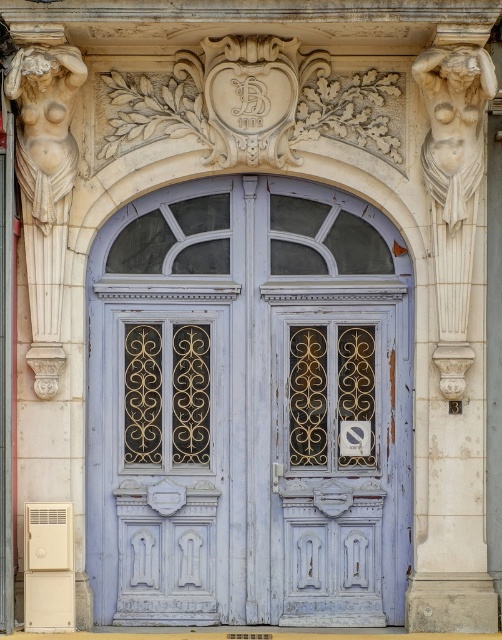
Does chipped paint wooden door at center have a greater height compared to white stone nude figure at right?

Indeed, chipped paint wooden door at center has a greater height compared to white stone nude figure at right.

Can you confirm if chipped paint wooden door at center is positioned to the left of white stone nude figure at right?

Indeed, chipped paint wooden door at center is positioned on the left side of white stone nude figure at right.

Consider the image. Who is more distant from viewer, (386, 472) or (462, 77)?

The point (386, 472) is more distant.

Locate an element on the screen. This screenshot has height=640, width=502. chipped paint wooden door at center is located at coordinates (339, 451).

Which of these two, light blue wood door at center or chipped paint wooden door at center, stands shorter?

With less height is chipped paint wooden door at center.

Looking at this image, does light blue wood door at center appear on the left side of chipped paint wooden door at center?

Indeed, light blue wood door at center is positioned on the left side of chipped paint wooden door at center.

Is point (146, 378) closer to camera compared to point (403, 349)?

No.

Locate an element on the screen. light blue wood door at center is located at coordinates (248, 408).

Who is positioned more to the right, light blue wood door at center or white stone nude figure at right?

Positioned to the right is white stone nude figure at right.

Between point (139, 312) and point (443, 113), which one is positioned behind?

Positioned behind is point (139, 312).

You are a GUI agent. You are given a task and a screenshot of the screen. Output one action in this format:
    pyautogui.click(x=<x>, y=<y>)
    Task: Click on the light blue wood door at center
    
    Given the screenshot: What is the action you would take?
    pyautogui.click(x=248, y=408)